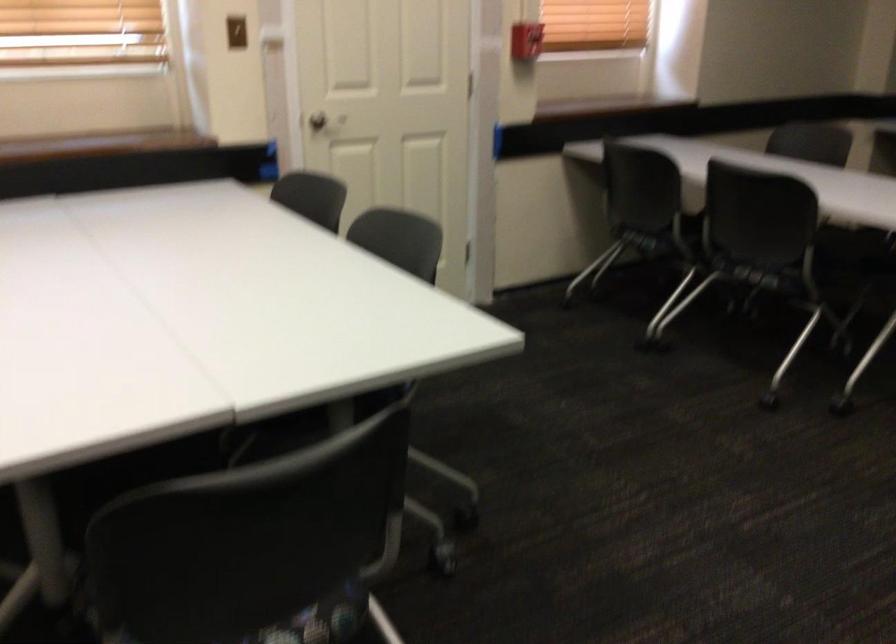
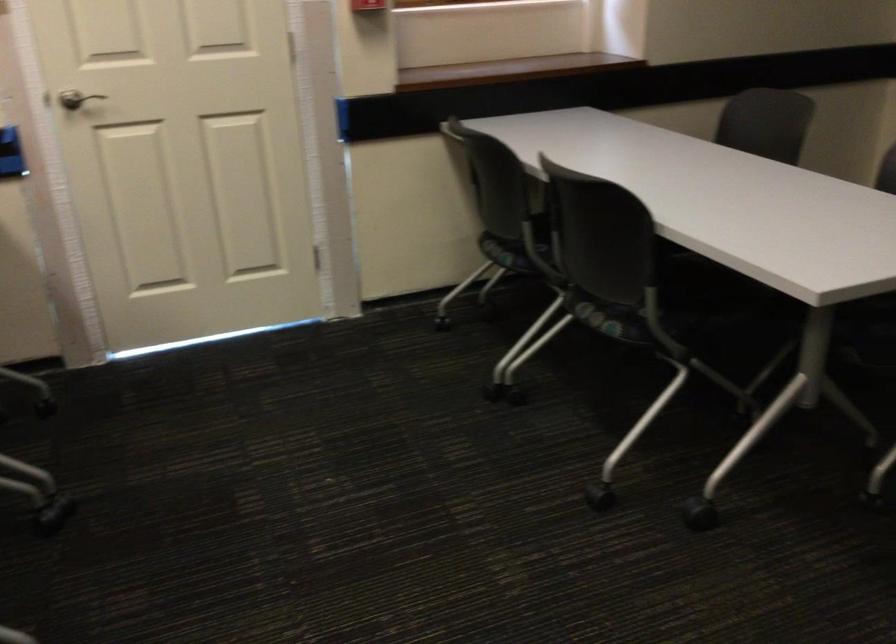
In a continuous first-person perspective shot, in which direction is the camera moving?

The cameraman walked toward right, forward.